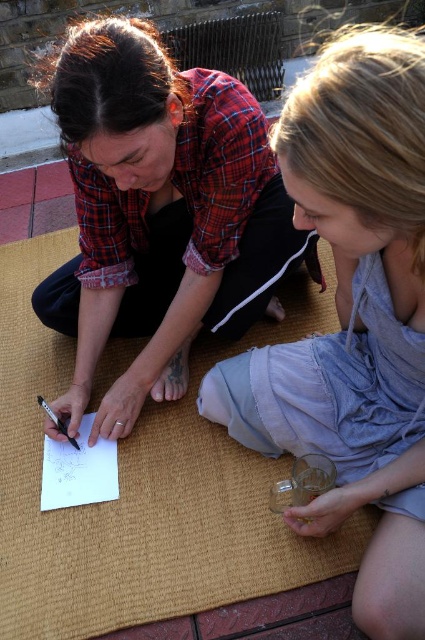
You are an artist who wants to draw on the white paper at center. Where should you place your hand holding the black plastic pen at lower left to reach the paper?

The white paper at center is below the black plastic pen at lower left, so you should move your hand holding the black plastic pen at lower left upwards to reach the paper.

You are an artist trying to sketch on the white paper at center. You have a black plastic pen at lower left. Can you tell me which object is wider?

The white paper at center is wider than the black plastic pen at lower left.